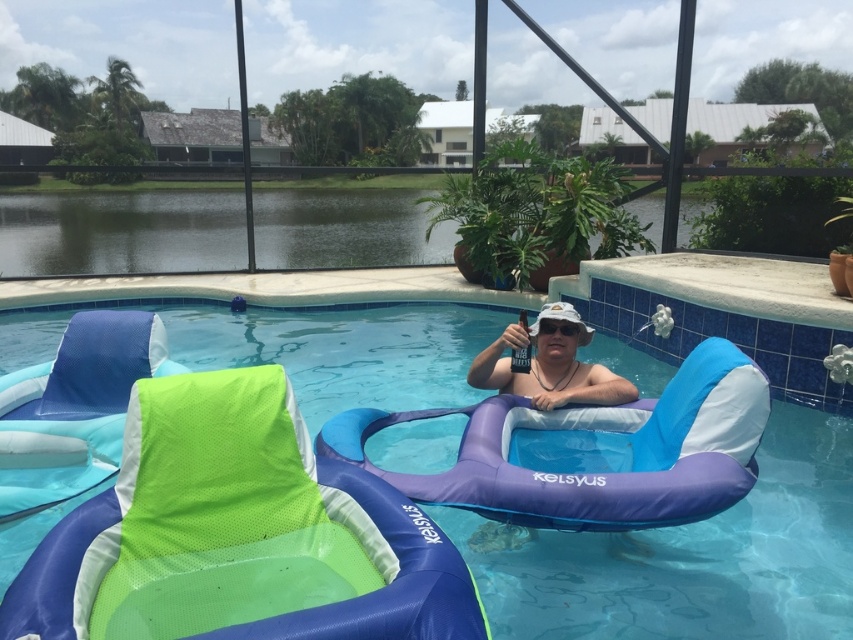
From the picture: You are standing at the edge of the pool and want to reach the blue inflatable float at center. Considering your height is 1.6 meters, can you comfortably reach it without entering the water?

The blue inflatable float at center is 3.31 meters away from you. Since the distance is greater than your height of 1.6 meters, you cannot comfortably reach it without entering the water.

You are planning to place a new float in the pool. The existing blue inflatable float at center is at coordinates 0.875, 0.817. If you want to place the new float 0.2 units to the right and 0.1 units above the existing float, what would be the new coordinates?

The new coordinates would be 0.875 plus 0.2 equals 1.075 for the x coordinate, and 0.817 minus 0.1 equals 0.717 for the y coordinate. However, since coordinates typically range from 0 to 1, the x coordinate of 1.075 exceeds the maximum limit. Therefore, the new float cannot be placed at those coordinates within the pool.

You are standing at the edge of the pool and want to place a new float at the point marked by coordinates point (695, 560). According to the scene, where exactly will this float be placed?

The point (695, 560) is on the blue inflatable float at center, so placing the new float there would position it directly on top of the existing blue inflatable float at center.